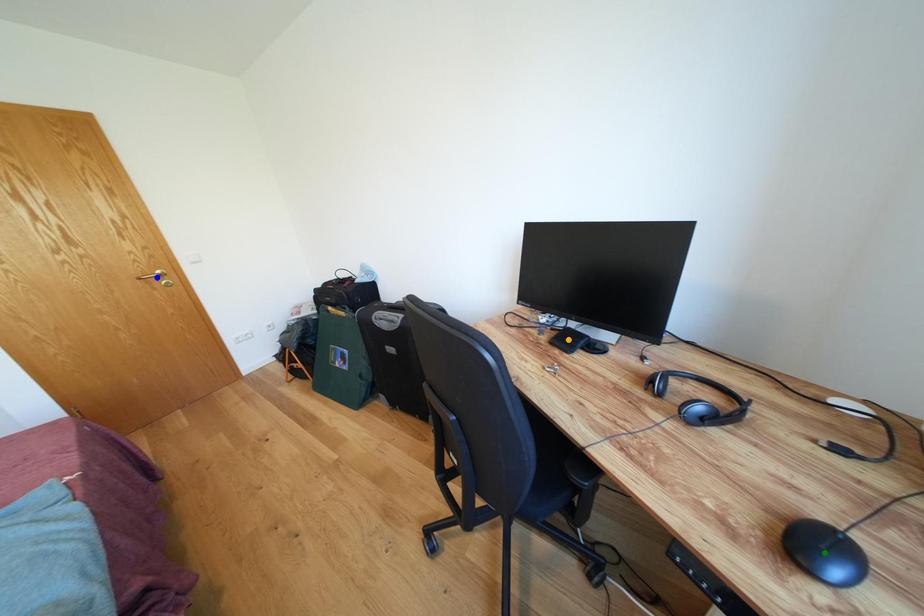
Order these from nearest to farthest:
green point, blue point, orange point

green point < orange point < blue point